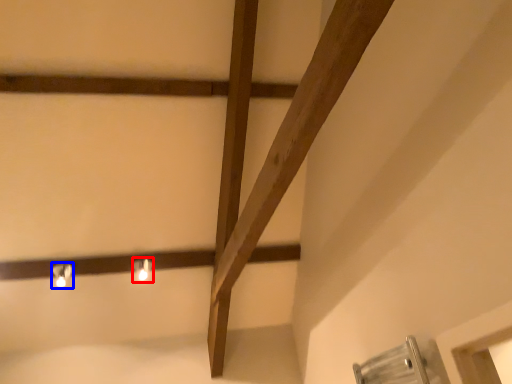
Question: Which of the following is the closest to the observer, light fixture (highlighted by a red box) or light fixture (highlighted by a blue box)?

Choices:
 (A) light fixture
 (B) light fixture

Answer: (B)